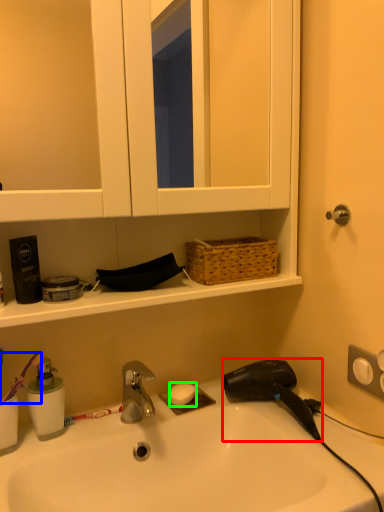
Question: Estimate the real-world distances between objects in this image. Which object is closer to hair drier (highlighted by a red box), brush (highlighted by a blue box) or soap (highlighted by a green box)?

Choices:
 (A) brush
 (B) soap

Answer: (B)